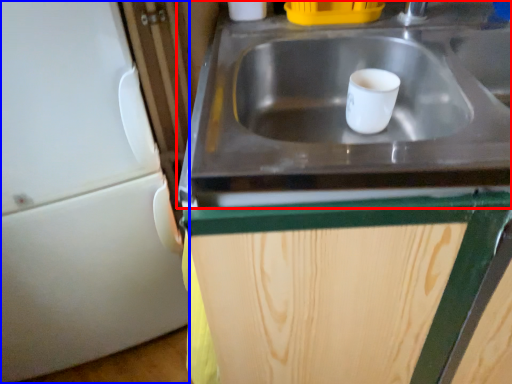
Question: Among these objects, which one is nearest to the camera, sink (highlighted by a red box) or appliance (highlighted by a blue box)?

Choices:
 (A) sink
 (B) appliance

Answer: (A)